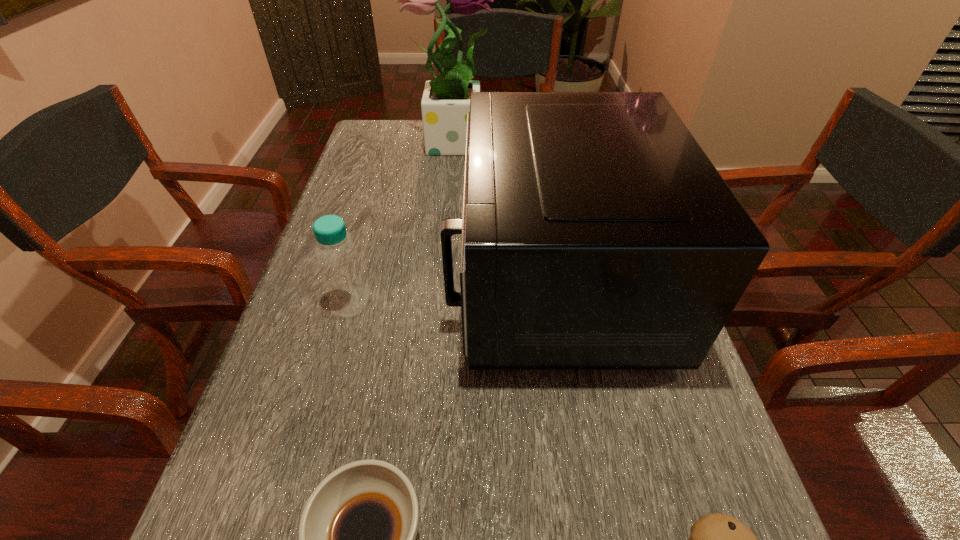
Where is `object that is at the far edge`? This screenshot has height=540, width=960. object that is at the far edge is located at coordinates (445, 103).

Find the location of a particular element. Image resolution: width=960 pixels, height=540 pixels. flower arrangement that is at the left edge is located at coordinates (445, 103).

This screenshot has height=540, width=960. I want to click on bottle that is at the left edge, so click(337, 256).

Where is `object that is at the right edge`? This screenshot has height=540, width=960. object that is at the right edge is located at coordinates (596, 233).

Locate an element on the screen. This screenshot has width=960, height=540. object at the far left corner is located at coordinates (445, 103).

The height and width of the screenshot is (540, 960). I want to click on free point at the left edge, so click(341, 214).

At what (x,y) coordinates should I click in order to perform the action: click on free space between the farthest object and the bottle. Please return your answer as a coordinate pair (x, y). Looking at the image, I should click on (401, 221).

The height and width of the screenshot is (540, 960). What are the coordinates of `object that is the closest one to the soup bowl` in the screenshot? It's located at (596, 233).

I want to click on the closest object to the muffin, so click(x=596, y=233).

The height and width of the screenshot is (540, 960). What are the coordinates of `vacant space that satisfies the following two spatial constraints: 1. on the front-facing side of the tallest object; 2. on the front side of the third tallest object` in the screenshot? It's located at (436, 302).